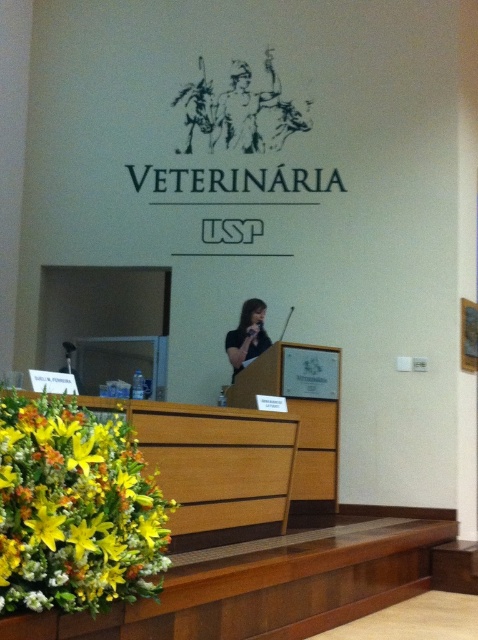
Question: In this image, where is vibrant floral arrangement at lower left located relative to black matte shirt at center?

Choices:
 (A) left
 (B) right

Answer: (A)

Question: Is vibrant floral arrangement at lower left wider than black matte shirt at center?

Choices:
 (A) no
 (B) yes

Answer: (B)

Question: Does vibrant floral arrangement at lower left lie behind black matte shirt at center?

Choices:
 (A) yes
 (B) no

Answer: (B)

Question: Which point is closer to the camera?

Choices:
 (A) (260, 321)
 (B) (129, 595)

Answer: (B)